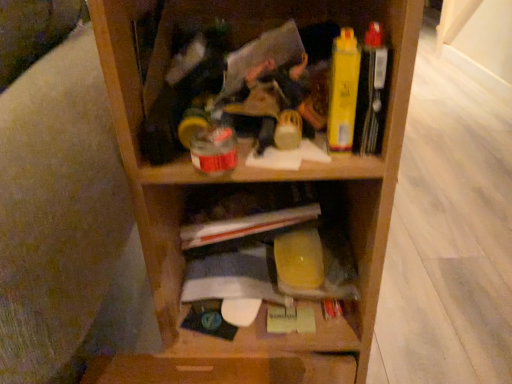
Identify the location of wooden shelf at center. (251, 196).

The width and height of the screenshot is (512, 384). What do you see at coordinates (371, 93) in the screenshot?
I see `yellow matte book at upper right` at bounding box center [371, 93].

Measure the distance between point (347, 346) and camera.

Point (347, 346) is 63.10 centimeters away from camera.

This screenshot has width=512, height=384. I want to click on wooden shelf at center, so click(x=251, y=196).

Does yellow matte book at upper right turn towards wooden shelf at center?

Yes, yellow matte book at upper right faces towards wooden shelf at center.

Which is farther, (360, 119) or (113, 45)?

The point (360, 119) is farther.

From a real-world perspective, is yellow matte book at upper right above or below wooden shelf at center?

Clearly, from a real-world perspective, yellow matte book at upper right is above wooden shelf at center.

Based on the photo, considering the sizes of objects wooden shelf at center and yellow matte book at upper right in the image provided, who is bigger, wooden shelf at center or yellow matte book at upper right?

With larger size is wooden shelf at center.

Where is `book above the wooden shelf at center (from the image's perspective)`? Image resolution: width=512 pixels, height=384 pixels. book above the wooden shelf at center (from the image's perspective) is located at coordinates (371, 93).

From a real-world perspective, is wooden shelf at center positioned under yellow matte book at upper right based on gravity?

Correct, in the physical world, wooden shelf at center is lower than yellow matte book at upper right.

From the image's perspective, is wooden shelf at center positioned above or below yellow plastic container at center?

Clearly, from the image's perspective, wooden shelf at center is above yellow plastic container at center.

Based on the photo, is yellow plastic container at center inside wooden shelf at center?

Yes, yellow plastic container at center is inside wooden shelf at center.

Does wooden shelf at center have a lesser height compared to yellow plastic container at center?

In fact, wooden shelf at center may be taller than yellow plastic container at center.

Is yellow plastic container at center oriented away from wooden shelf at center?

Absolutely, yellow plastic container at center is directed away from wooden shelf at center.

In the image, there is a wooden shelf at center. Find the location of `cabinet below it (from the image's perspective)`. cabinet below it (from the image's perspective) is located at coordinates (353, 257).

From a real-world perspective, who is located higher, yellow plastic container at center or wooden shelf at center?

wooden shelf at center is physically above.

How distant is yellow plastic container at center from wooden shelf at center?

yellow plastic container at center and wooden shelf at center are 1.73 inches apart from each other.

Is yellow plastic container at center completely or partially outside of yellow matte book at upper right?

Indeed, yellow plastic container at center is completely outside yellow matte book at upper right.

Is yellow plastic container at center oriented away from yellow matte book at upper right?

No.

Does yellow plastic container at center have a lesser height compared to yellow matte book at upper right?

Correct, yellow plastic container at center is not as tall as yellow matte book at upper right.

From the image's perspective, is yellow plastic container at center positioned above or below yellow matte book at upper right?

From the image's perspective, yellow plastic container at center appears below yellow matte book at upper right.

Based on the photo, would you say yellow matte book at upper right is a long distance from yellow plastic container at center?

No, yellow matte book at upper right is in close proximity to yellow plastic container at center.

Can you tell me how much yellow matte book at upper right and yellow plastic container at center differ in facing direction?

The angle between the facing direction of yellow matte book at upper right and the facing direction of yellow plastic container at center is 6.74 degrees.

From a real-world perspective, which object rests below the other?

From a 3D spatial view, yellow plastic container at center is below.

Consider the image. Would you say yellow matte book at upper right is to the left or to the right of yellow plastic container at center in the picture?

yellow matte book at upper right is to the right of yellow plastic container at center.

The height and width of the screenshot is (384, 512). In the image, there is a wooden shelf at center. In order to click on book above it (from the image's perspective) in this screenshot , I will do `click(371, 93)`.

Identify the location of shelf in front of the yellow matte book at upper right. (251, 196).

When comparing their distances from yellow plastic container at center, does wooden shelf at center or yellow matte book at upper right seem closer?

Among the two, wooden shelf at center is located nearer to yellow plastic container at center.

Based on their spatial positions, is yellow matte book at upper right or yellow plastic container at center closer to wooden shelf at center?

The object closer to wooden shelf at center is yellow plastic container at center.

When comparing their distances from wooden shelf at center, does yellow plastic container at center or yellow matte book at upper right seem closer?

Based on the image, yellow plastic container at center appears to be nearer to wooden shelf at center.

Looking at the image, which one is located closer to yellow matte book at upper right, wooden shelf at center or yellow plastic container at center?

The object closer to yellow matte book at upper right is wooden shelf at center.

Estimate the real-world distances between objects in this image. Which object is closer to yellow plastic container at center, yellow matte book at upper right or wooden shelf at center?

wooden shelf at center.

Looking at the image, which one is located further to yellow matte book at upper right, yellow plastic container at center or wooden shelf at center?

Based on the image, yellow plastic container at center appears to be further to yellow matte book at upper right.

Identify the location of book between wooden shelf at center and yellow plastic container at center in the front-back direction. (371, 93).